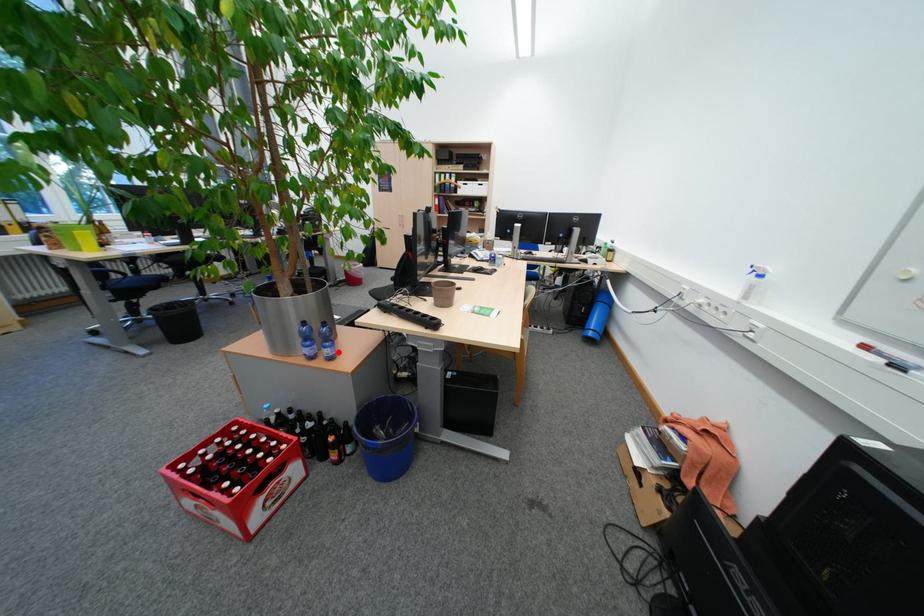
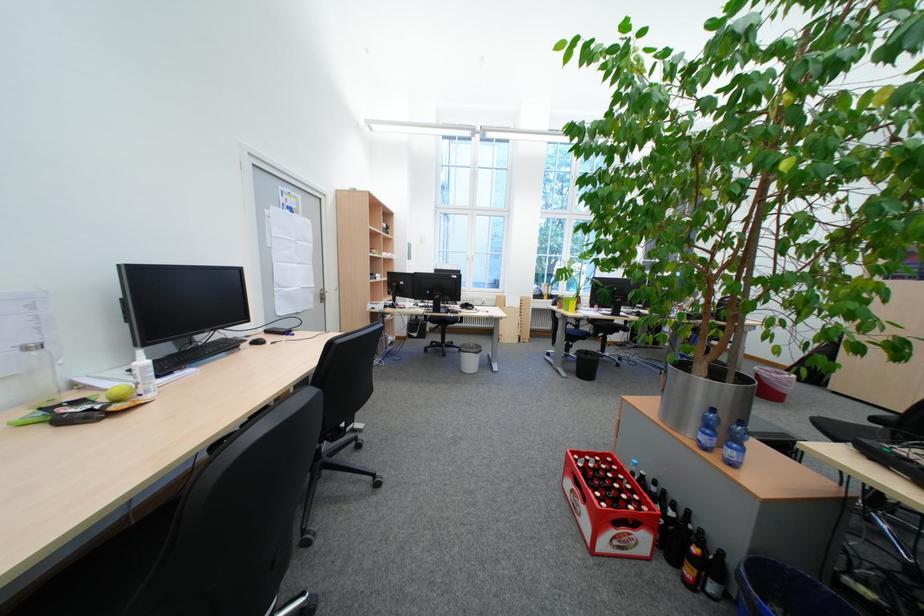
Question: I am providing you with two images of the same scene from different viewpoints. Given a red point in image1, look at the same physical point in image2. Is it:

Choices:
 (A) Closer to the viewpoint
 (B) Farther from the viewpoint

Answer: (B)